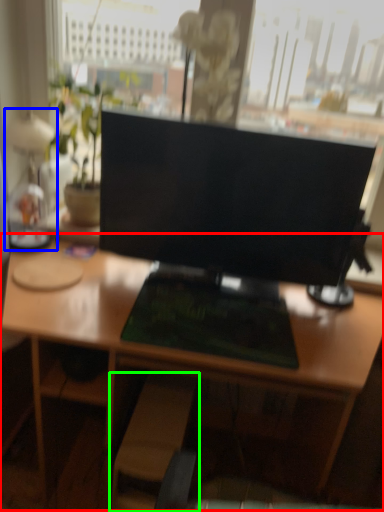
Question: Which is nearer to the desk (highlighted by a red box)? table lamp (highlighted by a blue box) or swivel chair (highlighted by a green box).

Choices:
 (A) table lamp
 (B) swivel chair

Answer: (B)